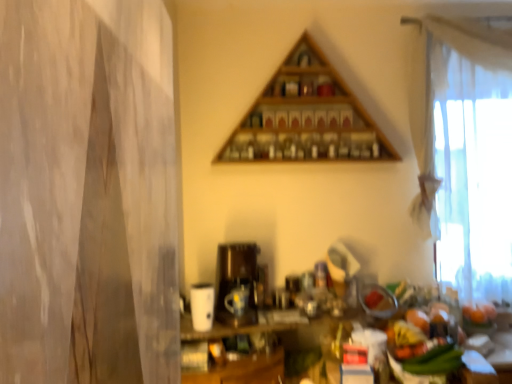
Question: From the image's perspective, is white sheer curtain at right located above or below matte black coffee machine at center?

Choices:
 (A) above
 (B) below

Answer: (A)

Question: Considering their positions, is white sheer curtain at right located in front of or behind matte black coffee machine at center?

Choices:
 (A) front
 (B) behind

Answer: (B)

Question: Which object is positioned farthest from the matte black coffee machine at center?

Choices:
 (A) white sheer curtain at right
 (B) wooden triangle at upper center

Answer: (A)

Question: Which is nearer to the white sheer curtain at right?

Choices:
 (A) wooden triangle at upper center
 (B) matte black coffee machine at center

Answer: (A)